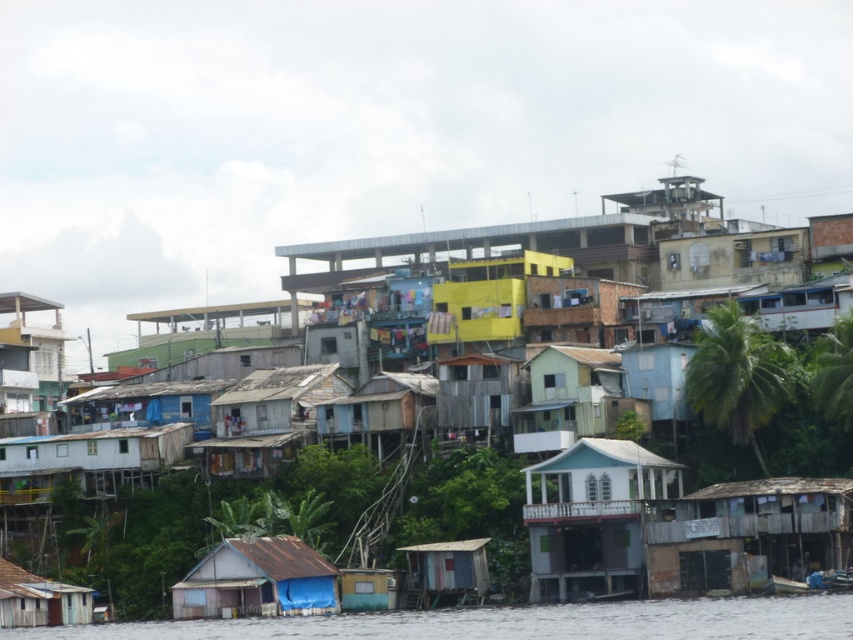
You are standing at the riverside settlement and want to know how far the point at coordinates (489, 624) is from your current position. Can you determine the distance?

The point at coordinates (489, 624) is 306.62 feet away from your current position.

You are a delivery person trying to park your 3m wide delivery cart between the weathered wood shack at lower right and the rusty metal hut at lower center. Can you fit your cart there based on their widths?

The weathered wood shack at lower right is wider than the rusty metal hut at lower center. Since the cart is 3 meters wide, you need to check the combined width of both structures to determine if there is enough space. However, the exact combined width isn

You are a visitor standing on the riverside path. You see the transparent plastic water at lower center and the rusty metal hut at lower center. Which object is higher up from the ground?

The transparent plastic water at lower center is much taller than the rusty metal hut at lower center, so the transparent plastic water at lower center is higher up from the ground.